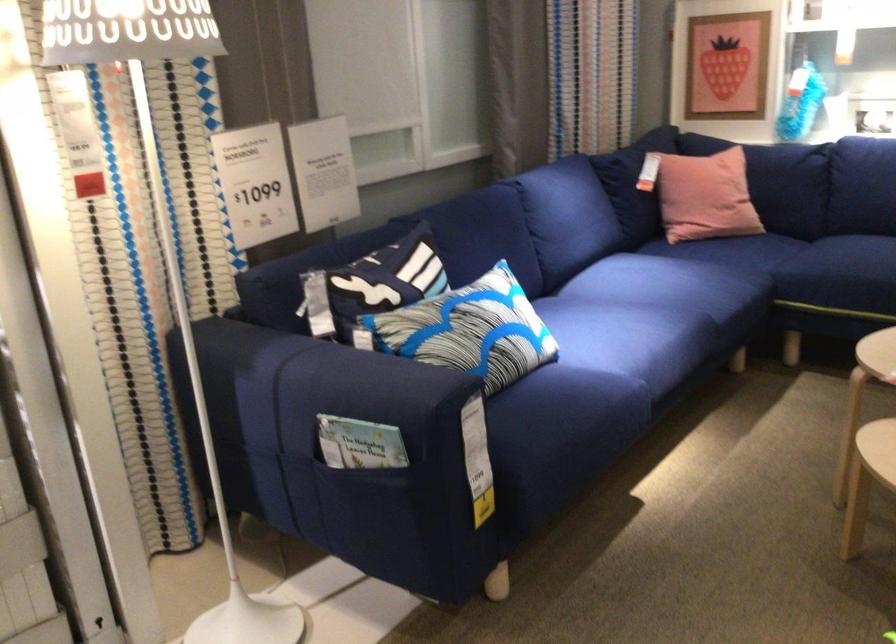
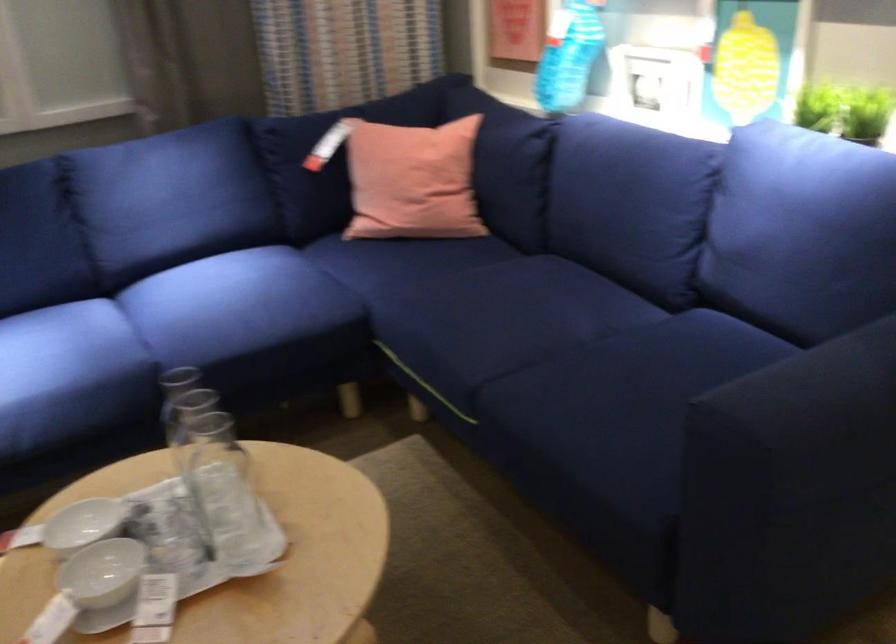
In the second image, find the point that corresponds to (731,178) in the first image.

(412, 181)